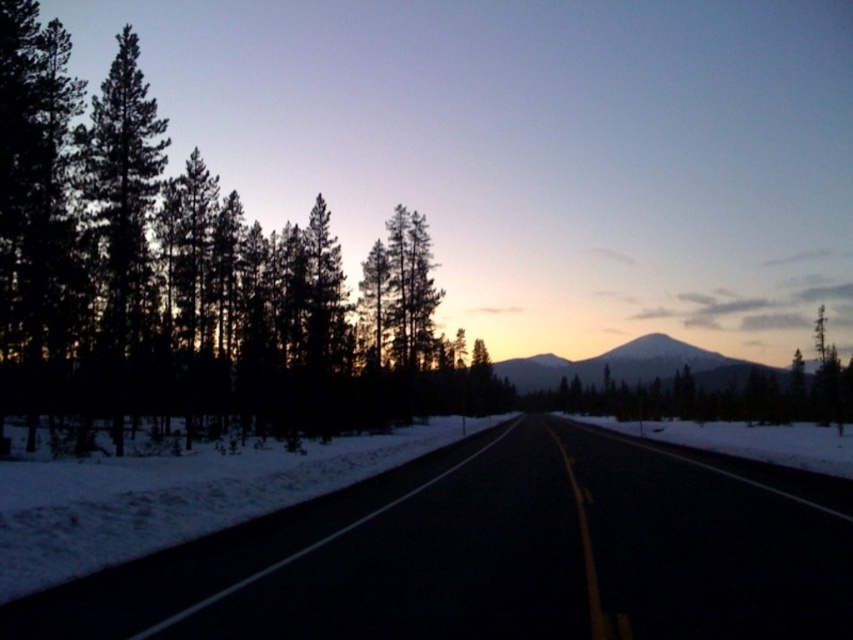
You are a driver approaching the black asphalt road at center and the silky dark green trees at left. Which object is closer to the horizon?

The black asphalt road at center is located below the silky dark green trees at left, so the silky dark green trees at left are closer to the horizon.

You are a driver approaching the black asphalt road at center and the silky dark green trees at left. Which object will you first encounter as you move forward?

The black asphalt road at center will be encountered first because it is closer to the viewer than the silky dark green trees at left.